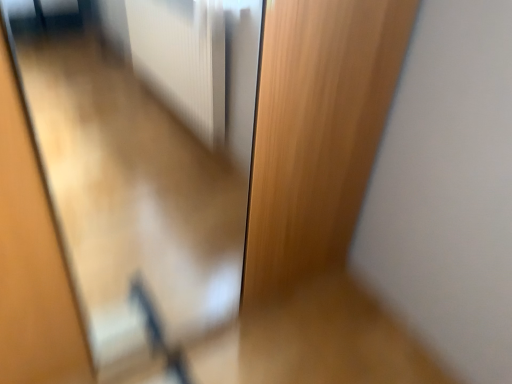
What do you see at coordinates (121, 183) in the screenshot? I see `wooden mirror at center` at bounding box center [121, 183].

The image size is (512, 384). I want to click on wooden mirror at center, so click(121, 183).

Locate an element on the screen. The image size is (512, 384). wooden mirror at center is located at coordinates (121, 183).